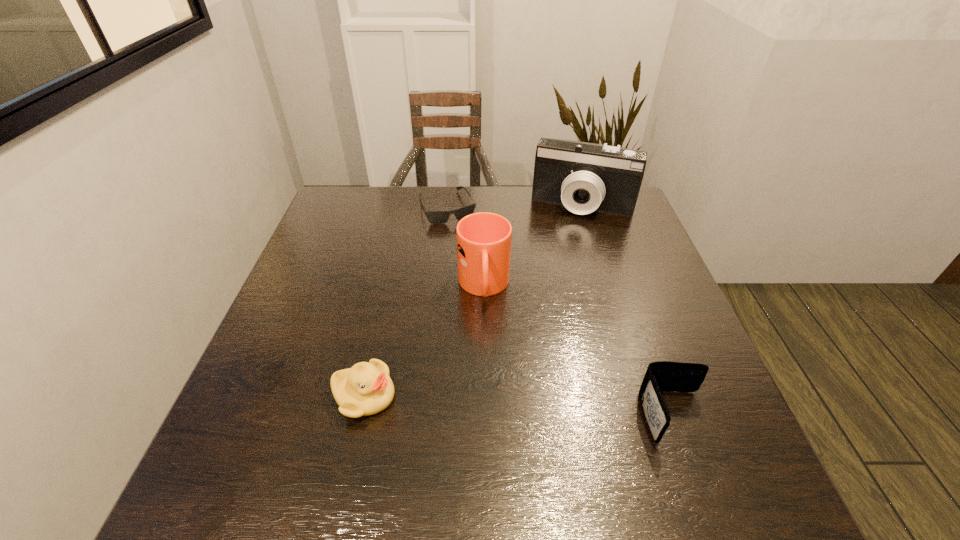
Locate an element on the screen. vacant space located 0.270m on the lens of the tallest object is located at coordinates (554, 280).

Identify the location of blank area located 0.200m on the lens of the tallest object. The width and height of the screenshot is (960, 540). (560, 264).

Find the location of `vacant point located 0.380m on the lens of the tallest object`. vacant point located 0.380m on the lens of the tallest object is located at coordinates (545, 310).

The height and width of the screenshot is (540, 960). Identify the location of blank area located on the handle side of the mug. (498, 417).

Identify the location of vacant region located 0.290m on the handle side of the mug. The image size is (960, 540). (500, 427).

This screenshot has width=960, height=540. What are the coordinates of `vacant space located on the handle side of the mug` in the screenshot? It's located at (499, 422).

Where is `sunglasses at the far edge`? sunglasses at the far edge is located at coordinates (434, 217).

At what (x,y) coordinates should I click in order to perform the action: click on camcorder situated at the far edge. Please return your answer as a coordinate pair (x, y). Image resolution: width=960 pixels, height=540 pixels. Looking at the image, I should click on (584, 177).

I want to click on duckling that is at the near edge, so click(365, 389).

Image resolution: width=960 pixels, height=540 pixels. In order to click on wallet that is at the near edge in this screenshot , I will do `click(660, 376)`.